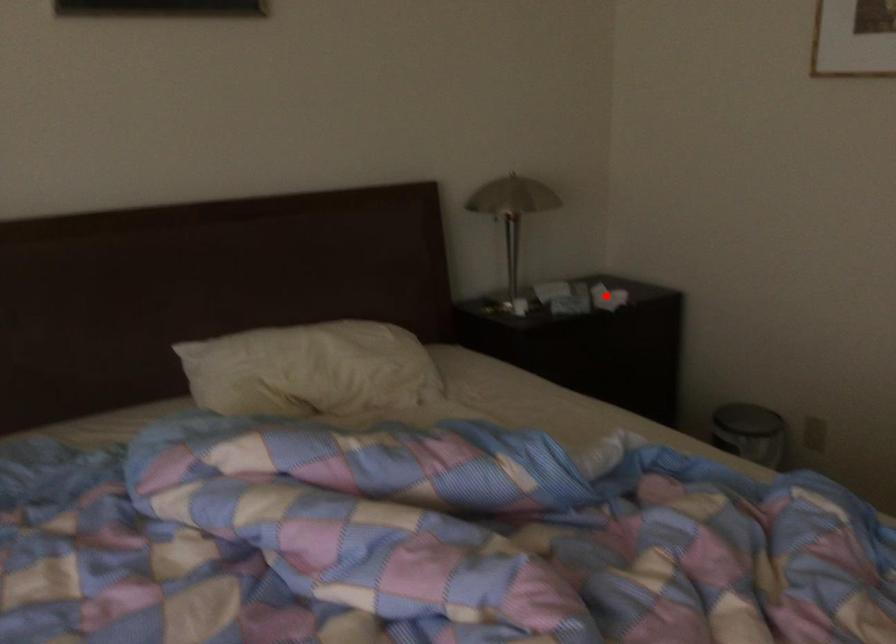
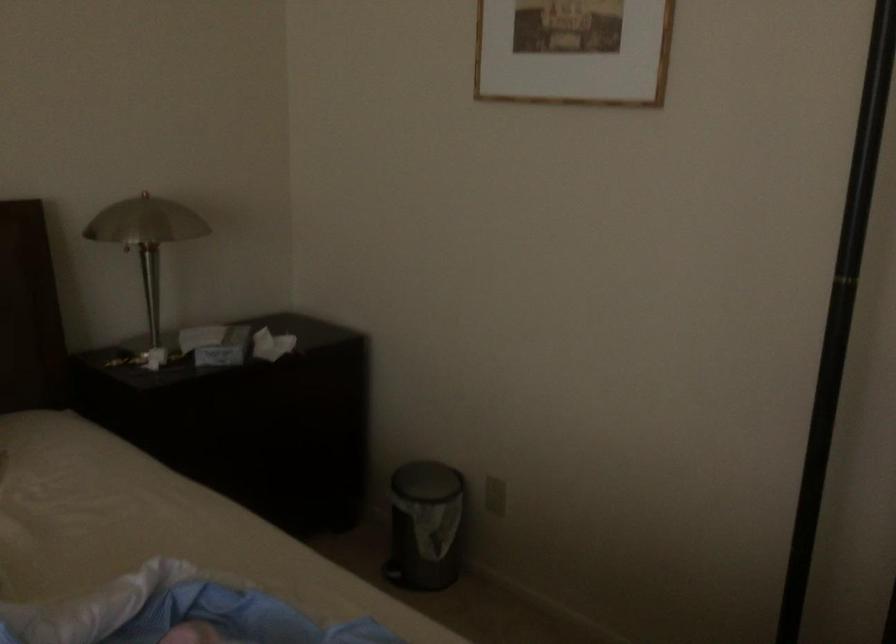
Where in the second image is the point corresponding to the highlighted location from the first image?

(271, 345)